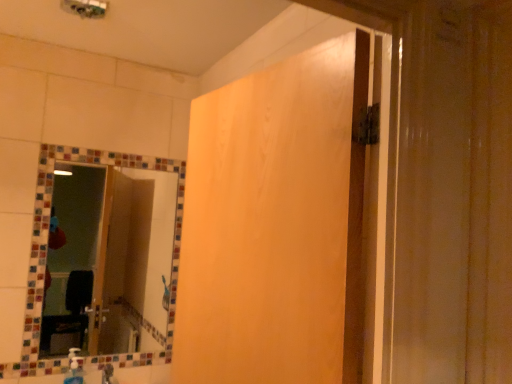
Question: Is wooden panel at center positioned beyond the bounds of multicolored mosaic mirror at upper left?

Choices:
 (A) yes
 (B) no

Answer: (A)

Question: Considering the relative sizes of wooden panel at center and multicolored mosaic mirror at upper left in the image provided, is wooden panel at center wider than multicolored mosaic mirror at upper left?

Choices:
 (A) no
 (B) yes

Answer: (B)

Question: From the image's perspective, is wooden panel at center on top of multicolored mosaic mirror at upper left?

Choices:
 (A) yes
 (B) no

Answer: (A)

Question: From a real-world perspective, is wooden panel at center located higher than multicolored mosaic mirror at upper left?

Choices:
 (A) yes
 (B) no

Answer: (A)

Question: Does wooden panel at center have a smaller size compared to multicolored mosaic mirror at upper left?

Choices:
 (A) yes
 (B) no

Answer: (B)

Question: Is wooden panel at center aimed at multicolored mosaic mirror at upper left?

Choices:
 (A) no
 (B) yes

Answer: (A)

Question: Is wooden panel at center aimed at translucent plastic soap dispenser at lower left?

Choices:
 (A) no
 (B) yes

Answer: (A)

Question: Does wooden panel at center have a smaller size compared to translucent plastic soap dispenser at lower left?

Choices:
 (A) no
 (B) yes

Answer: (A)

Question: Considering the relative positions of wooden panel at center and translucent plastic soap dispenser at lower left in the image provided, is wooden panel at center to the right of translucent plastic soap dispenser at lower left from the viewer's perspective?

Choices:
 (A) no
 (B) yes

Answer: (B)

Question: Is wooden panel at center thinner than translucent plastic soap dispenser at lower left?

Choices:
 (A) no
 (B) yes

Answer: (A)

Question: From a real-world perspective, is wooden panel at center on top of translucent plastic soap dispenser at lower left?

Choices:
 (A) yes
 (B) no

Answer: (A)

Question: From the image's perspective, is wooden panel at center under translucent plastic soap dispenser at lower left?

Choices:
 (A) no
 (B) yes

Answer: (A)

Question: Is translucent plastic soap dispenser at lower left at the right side of wooden panel at center?

Choices:
 (A) yes
 (B) no

Answer: (B)